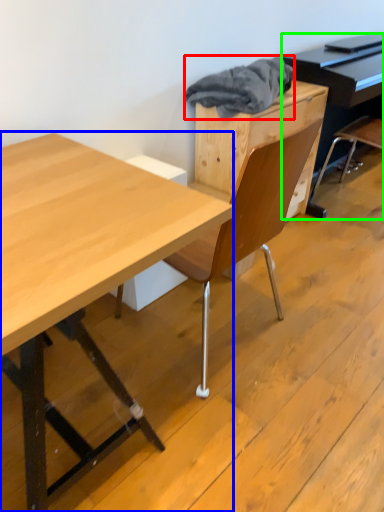
Question: Based on their relative distances, which object is nearer to material (highlighted by a red box)? Choose from desk (highlighted by a blue box) and piano (highlighted by a green box).

Choices:
 (A) desk
 (B) piano

Answer: (B)